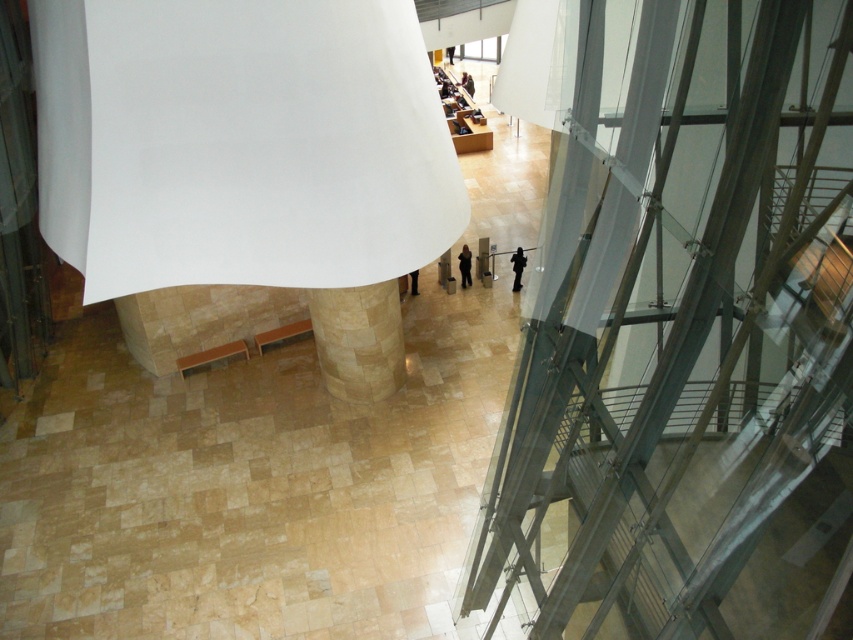
Question: Is beige marble pillar at center above black leather pants at center?

Choices:
 (A) yes
 (B) no

Answer: (B)

Question: Which object is positioned farthest from the black leather pants at center?

Choices:
 (A) black matte person at center
 (B) dark brown leather jacket at center
 (C) black matte jacket at center
 (D) beige marble pillar at center

Answer: (B)

Question: Which point appears farthest from the camera in this image?

Choices:
 (A) (376, 346)
 (B) (457, 257)
 (C) (519, 252)

Answer: (B)

Question: Based on their relative distances, which object is farther from the beige marble pillar at center?

Choices:
 (A) dark brown leather jacket at center
 (B) black leather pants at center
 (C) black matte person at center
 (D) black matte jacket at center

Answer: (A)

Question: Is black matte jacket at center positioned before dark brown leather jacket at center?

Choices:
 (A) yes
 (B) no

Answer: (A)

Question: Can you confirm if beige marble pillar at center is smaller than black matte person at center?

Choices:
 (A) no
 (B) yes

Answer: (A)